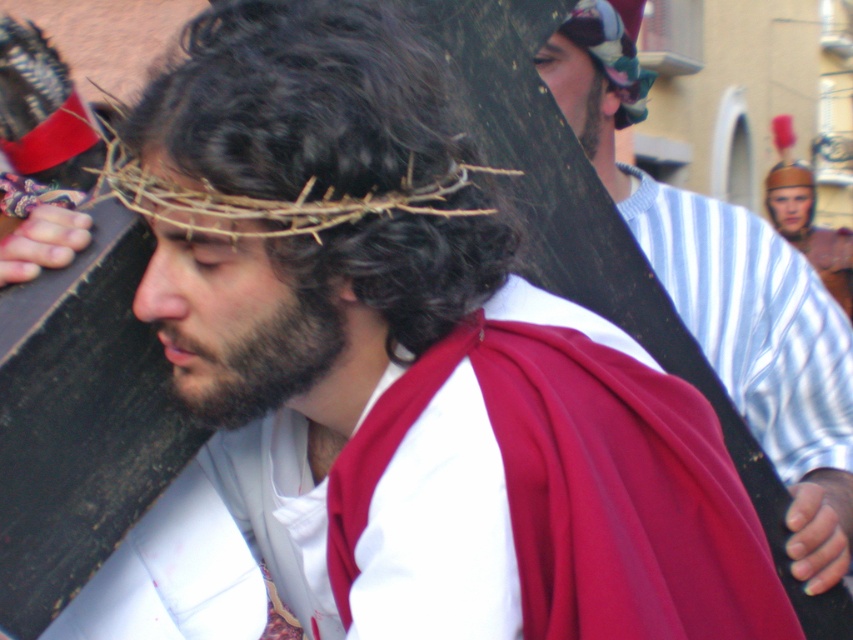
Can you confirm if brown woven crown at center is positioned to the right of brownwoollybeard at center?

Indeed, brown woven crown at center is positioned on the right side of brownwoollybeard at center.

Can you confirm if brown woven crown at center is positioned to the left of brownwoollybeard at center?

Incorrect, brown woven crown at center is not on the left side of brownwoollybeard at center.

Who is more forward, (477, 275) or (323, 324)?

Point (323, 324) is more forward.

This screenshot has height=640, width=853. I want to click on brown woven crown at center, so click(x=303, y=205).

Can you confirm if brown leather helmet at upper center is positioned below dark brown beard at upper center?

No, brown leather helmet at upper center is not below dark brown beard at upper center.

The height and width of the screenshot is (640, 853). What do you see at coordinates (788, 198) in the screenshot?
I see `brown leather helmet at upper center` at bounding box center [788, 198].

Where is `brown leather helmet at upper center`? The width and height of the screenshot is (853, 640). brown leather helmet at upper center is located at coordinates (788, 198).

Can you confirm if brown woven crown at center is positioned above brown leather helmet at upper center?

No, brown woven crown at center is not above brown leather helmet at upper center.

Which is more to the right, brown woven crown at center or brown leather helmet at upper center?

brown leather helmet at upper center

Is point (209, 369) behind point (805, 189)?

No, it is not.

This screenshot has height=640, width=853. In order to click on brown woven crown at center in this screenshot , I will do `click(303, 205)`.